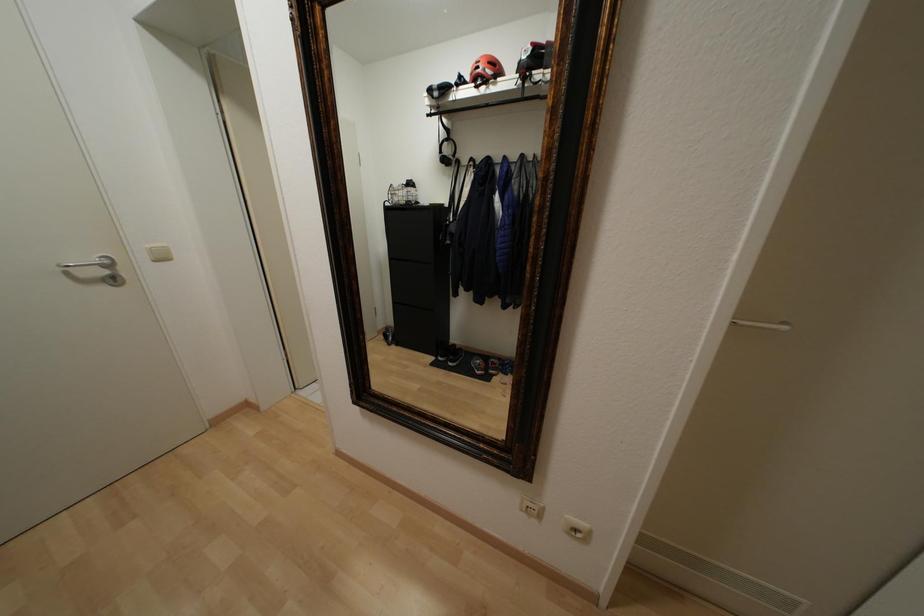
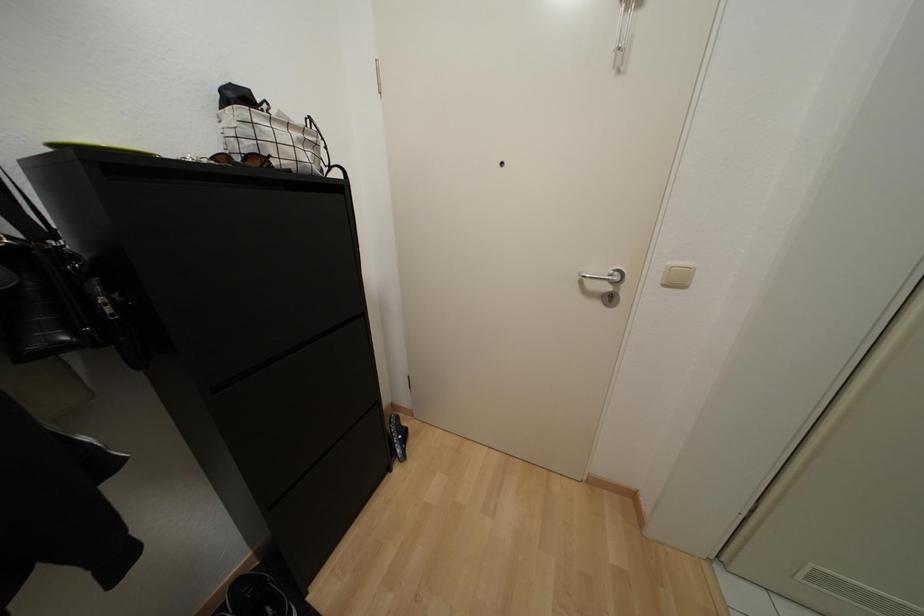
Based on the continuous images, in which direction is the camera rotating?

The camera's rotation is toward left-down.